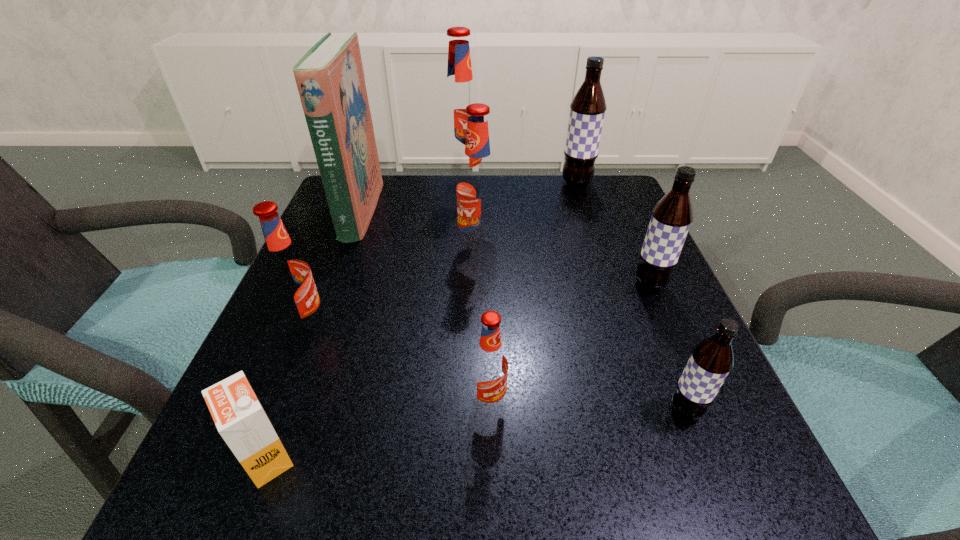
At what (x,y) coordinates should I click in order to perform the action: click on the biggest red root beer. Please return your answer as a coordinate pair (x, y). The image size is (960, 540). Looking at the image, I should click on (460, 93).

You are a GUI agent. You are given a task and a screenshot of the screen. Output one action in this format:
    pyautogui.click(x=<x>, y=<y>)
    Task: Click on the tallest root beer
    Image resolution: width=960 pixels, height=540 pixels.
    Given the screenshot: What is the action you would take?
    pyautogui.click(x=460, y=93)

Where is `hardback book`? This screenshot has height=540, width=960. hardback book is located at coordinates (330, 79).

At what (x,y) coordinates should I click in order to perform the action: click on the biggest brown root beer. Please return your answer as a coordinate pair (x, y). The width and height of the screenshot is (960, 540). Looking at the image, I should click on (587, 110).

What are the coordinates of `the second biggest red root beer` in the screenshot? It's located at (478, 189).

The image size is (960, 540). In order to click on the third farthest root beer in this screenshot , I will do `click(478, 189)`.

You are a GUI agent. You are given a task and a screenshot of the screen. Output one action in this format:
    pyautogui.click(x=<x>, y=<y>)
    Task: Click on the fourth farthest root beer
    
    Given the screenshot: What is the action you would take?
    pyautogui.click(x=671, y=218)

Identify the location of the second nearest brown root beer. (671, 218).

The width and height of the screenshot is (960, 540). I want to click on the leftmost red root beer, so click(288, 274).

Where is `the sixth farthest object`? the sixth farthest object is located at coordinates (288, 274).